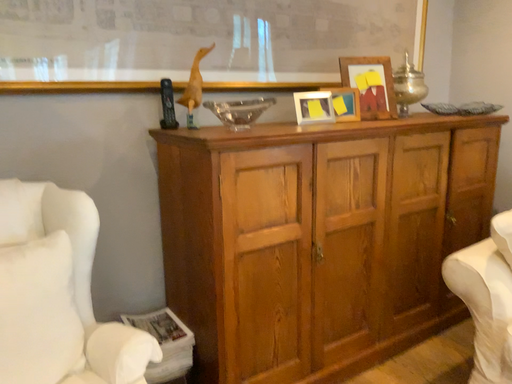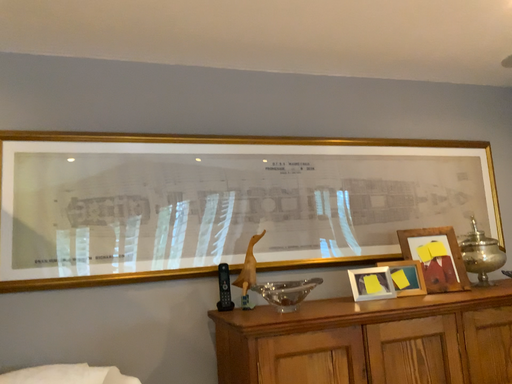
Question: Which way did the camera rotate in the video?

Choices:
 (A) rotated upward
 (B) rotated downward

Answer: (A)